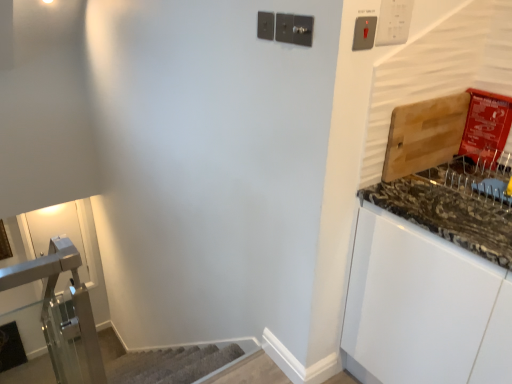
Question: Which is correct: satin nickel light switch at upper center, marked as the third light switch in a right-to-left arrangement, is inside white plastic light switch at upper right, the first light switch from the right, or outside of it?

Choices:
 (A) inside
 (B) outside

Answer: (B)

Question: Considering the positions of point (283, 18) and point (392, 14), is point (283, 18) closer or farther from the camera than point (392, 14)?

Choices:
 (A) farther
 (B) closer

Answer: (A)

Question: Which is nearer to the white plastic light switch at upper right, the first light switch from the right?

Choices:
 (A) satin nickel light switch at upper center, marked as the third light switch in a right-to-left arrangement
 (B) granite/stone cutting board at right
 (C) metallic silver light switch at upper right, the second light switch in the right-to-left sequence

Answer: (C)

Question: Estimate the real-world distances between objects in this image. Which object is closer to the metallic silver light switch at upper right, the second light switch in the right-to-left sequence?

Choices:
 (A) granite/stone cutting board at right
 (B) satin nickel light switch at upper center, placed as the first light switch when sorted from left to right
 (C) white plastic light switch at upper right, the first light switch from the right

Answer: (C)